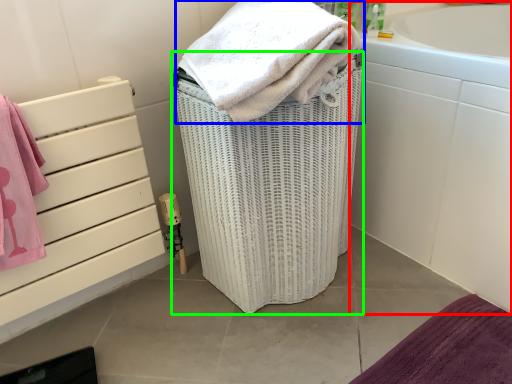
Question: Which object is the closest to the bath (highlighted by a red box)? Choose among these: towel (highlighted by a blue box) or basket container (highlighted by a green box).

Choices:
 (A) towel
 (B) basket container

Answer: (B)